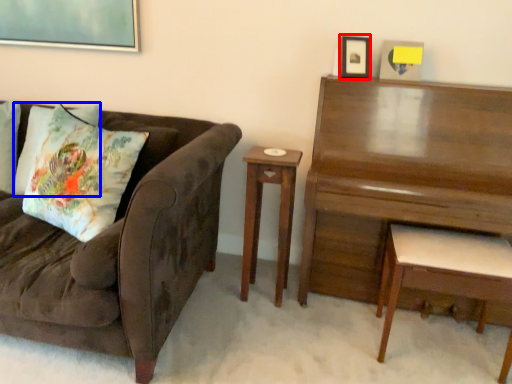
Question: Which object appears closest to the camera in this image, picture frame (highlighted by a red box) or pillow (highlighted by a blue box)?

Choices:
 (A) picture frame
 (B) pillow

Answer: (A)